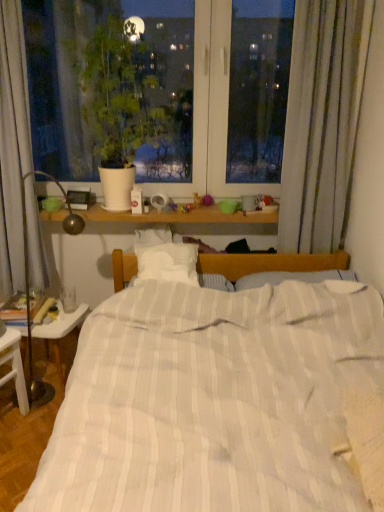
Question: From a real-world perspective, is white glossy table at lower left positioned over green matte plant at upper left based on gravity?

Choices:
 (A) yes
 (B) no

Answer: (B)

Question: Does white glossy table at lower left have a greater width compared to green matte plant at upper left?

Choices:
 (A) yes
 (B) no

Answer: (B)

Question: Considering the relative sizes of white glossy table at lower left and green matte plant at upper left in the image provided, is white glossy table at lower left smaller than green matte plant at upper left?

Choices:
 (A) no
 (B) yes

Answer: (B)

Question: Does white glossy table at lower left come behind green matte plant at upper left?

Choices:
 (A) yes
 (B) no

Answer: (A)

Question: Is white glossy table at lower left oriented towards green matte plant at upper left?

Choices:
 (A) no
 (B) yes

Answer: (A)

Question: Considering the relative positions of white glossy table at lower left and green matte plant at upper left in the image provided, is white glossy table at lower left in front of green matte plant at upper left?

Choices:
 (A) yes
 (B) no

Answer: (B)

Question: Does green matte plant at upper left lie behind white plastic nightstand at lower left?

Choices:
 (A) no
 (B) yes

Answer: (B)

Question: Is the surface of green matte plant at upper left in direct contact with white plastic nightstand at lower left?

Choices:
 (A) no
 (B) yes

Answer: (A)

Question: Is green matte plant at upper left positioned with its back to white plastic nightstand at lower left?

Choices:
 (A) yes
 (B) no

Answer: (B)

Question: Is green matte plant at upper left positioned beyond the bounds of white plastic nightstand at lower left?

Choices:
 (A) yes
 (B) no

Answer: (A)

Question: From the image's perspective, is green matte plant at upper left over white plastic nightstand at lower left?

Choices:
 (A) yes
 (B) no

Answer: (A)

Question: Considering the relative sizes of green matte plant at upper left and white plastic nightstand at lower left in the image provided, is green matte plant at upper left bigger than white plastic nightstand at lower left?

Choices:
 (A) no
 (B) yes

Answer: (B)

Question: Does white striped bed at center come in front of white glossy table at lower left?

Choices:
 (A) no
 (B) yes

Answer: (B)